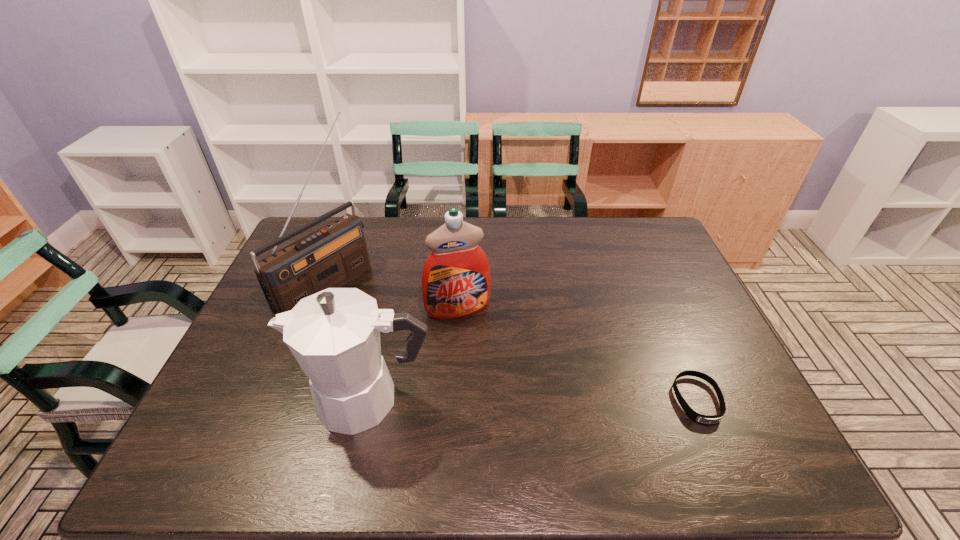
Identify the location of object that is at the near right corner. (699, 418).

I want to click on blank space at the far edge of the desktop, so click(x=580, y=248).

The height and width of the screenshot is (540, 960). In the image, there is a desktop. What are the coordinates of `free region at the near edge` in the screenshot? It's located at (670, 413).

In the image, there is a desktop. Identify the location of blank space at the right edge. (686, 310).

In the image, there is a desktop. What are the coordinates of `free space at the far right corner` in the screenshot? It's located at (631, 225).

Find the location of `free space between the wristband and the coffeepot`. free space between the wristband and the coffeepot is located at coordinates (533, 400).

The image size is (960, 540). I want to click on free space between the detergent and the rightmost object, so click(x=578, y=354).

I want to click on free area in between the tallest object and the rightmost object, so click(x=512, y=341).

Locate an element on the screen. This screenshot has height=540, width=960. free space between the detergent and the radio receiver is located at coordinates (392, 295).

Where is `free space that is in between the rightmost object and the detergent`? free space that is in between the rightmost object and the detergent is located at coordinates (578, 354).